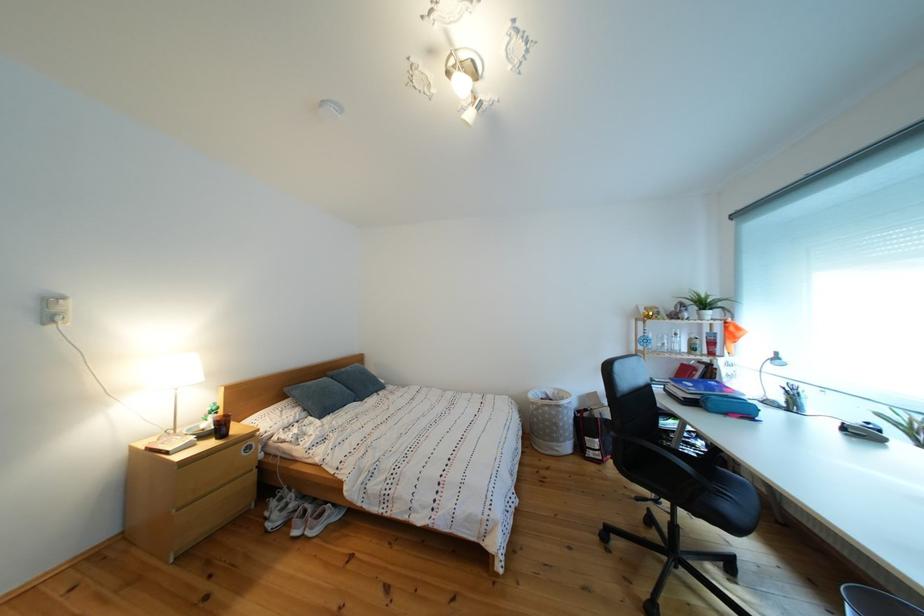
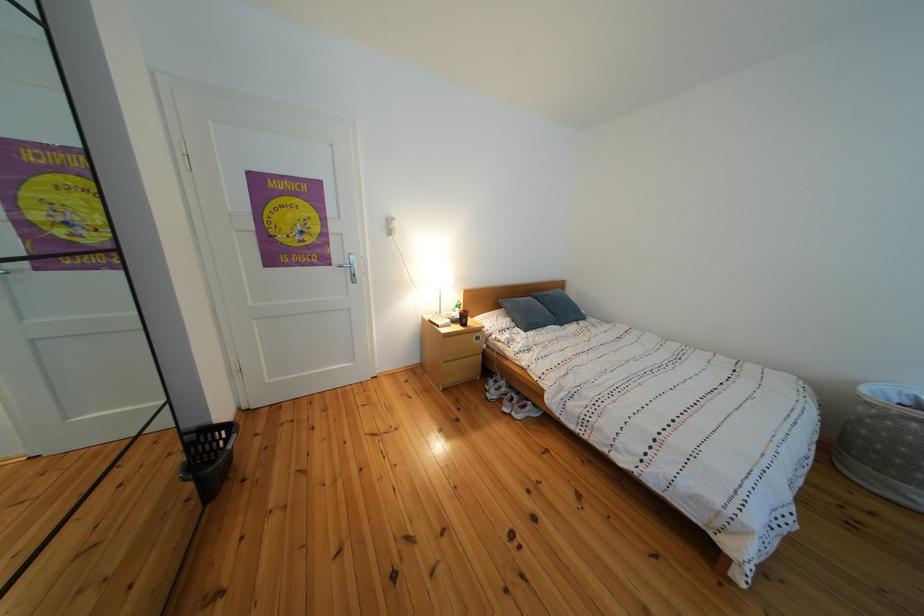
Locate, in the second image, the point that corresponds to point 347,378 in the first image.

(552, 300)